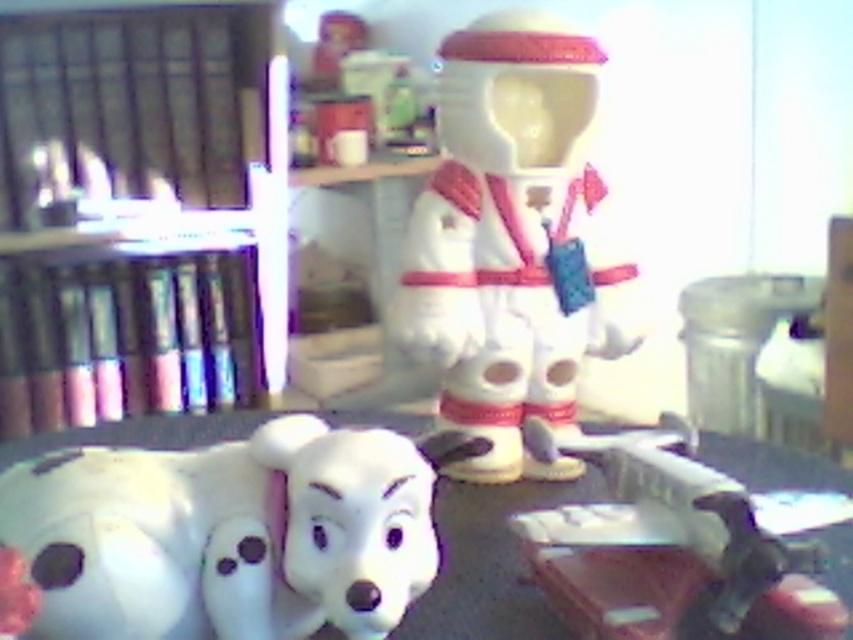
You are organizing a shelf in the room and need to place a new item between the metallic black bookshelf at left and the white glossy astronaut at center. Based on their positions, where should you place the item to ensure it is between them?

The metallic black bookshelf at left is above the white glossy astronaut at center, so to place an item between them, you should position it below the bookshelf but above the astronaut.

You are trying to decide where to place a tall plant that needs a stable support. Based on the scene, which object between the metallic black bookshelf at left and the white plastic table at lower center would be more suitable for this purpose?

The metallic black bookshelf at left is much taller than the white plastic table at lower center, so it would provide a more stable support for the tall plant.

You are setting up a small display on a table and want to place the white glossy astronaut at center and the white plastic table at lower center. The table is only 6 inches wide. Can both items fit on the table without overlapping?

The white glossy astronaut at center is 6.55 inches from the white plastic table at lower center. Since the table is only 6 inches wide, the distance between them is greater than the table width, so they cannot both fit on the table without overlapping.